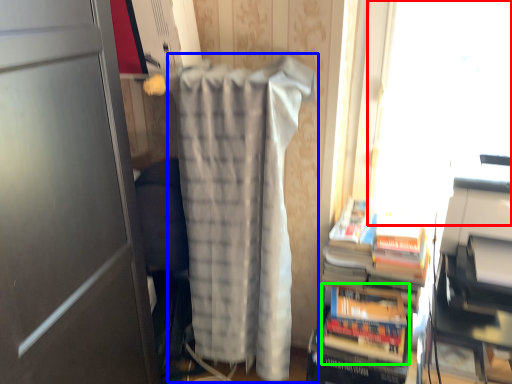
Question: Which object is the closest to the window screen (highlighted by a red box)? Choose among these: blanket (highlighted by a blue box) or paperback book (highlighted by a green box).

Choices:
 (A) blanket
 (B) paperback book

Answer: (B)